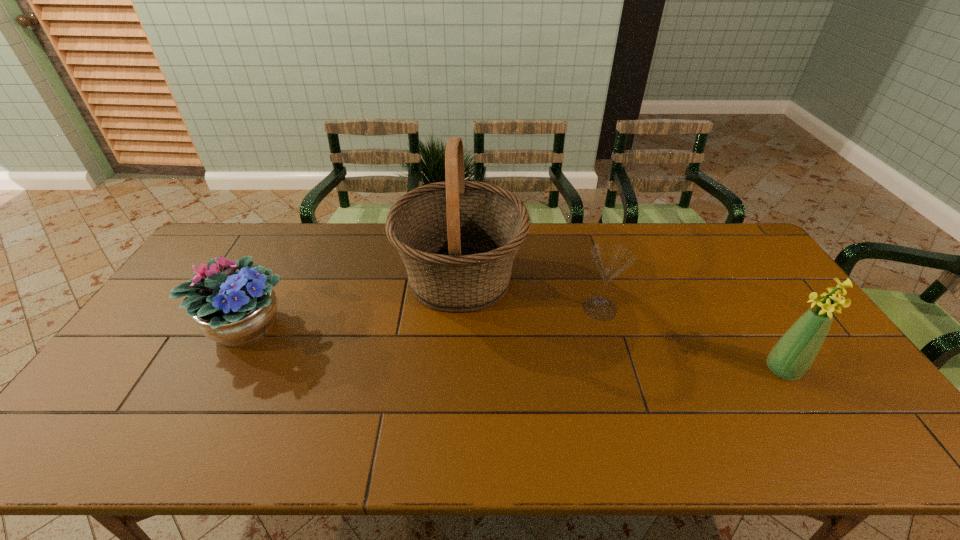
The image size is (960, 540). I want to click on empty space that is in between the shorter bouquet and the second object from left to right, so click(x=352, y=302).

Where is `free area in between the tallest object and the flute glass`? free area in between the tallest object and the flute glass is located at coordinates (530, 293).

Find the location of a particular element. The image size is (960, 540). free space between the basket and the flute glass is located at coordinates (530, 293).

The image size is (960, 540). Identify the location of empty space between the third shortest object and the flute glass. (691, 339).

Identify the location of free space between the basket and the third shortest object. Image resolution: width=960 pixels, height=540 pixels. (621, 325).

This screenshot has width=960, height=540. Find the location of `free space between the taller bouquet and the left bouquet`. free space between the taller bouquet and the left bouquet is located at coordinates (514, 348).

Locate an element on the screen. The height and width of the screenshot is (540, 960). free space that is in between the third object from left to right and the leftmost object is located at coordinates (422, 318).

Find the location of `vacant point located between the shorter bouquet and the rightmost object`. vacant point located between the shorter bouquet and the rightmost object is located at coordinates (514, 348).

You are a GUI agent. You are given a task and a screenshot of the screen. Output one action in this format:
    pyautogui.click(x=<x>, y=<y>)
    Task: Click on the vacant point located between the basket and the taller bouquet
    The image size is (960, 540).
    Given the screenshot: What is the action you would take?
    pyautogui.click(x=621, y=325)

The width and height of the screenshot is (960, 540). I want to click on vacant region between the third object from right to left and the shorter bouquet, so click(352, 302).